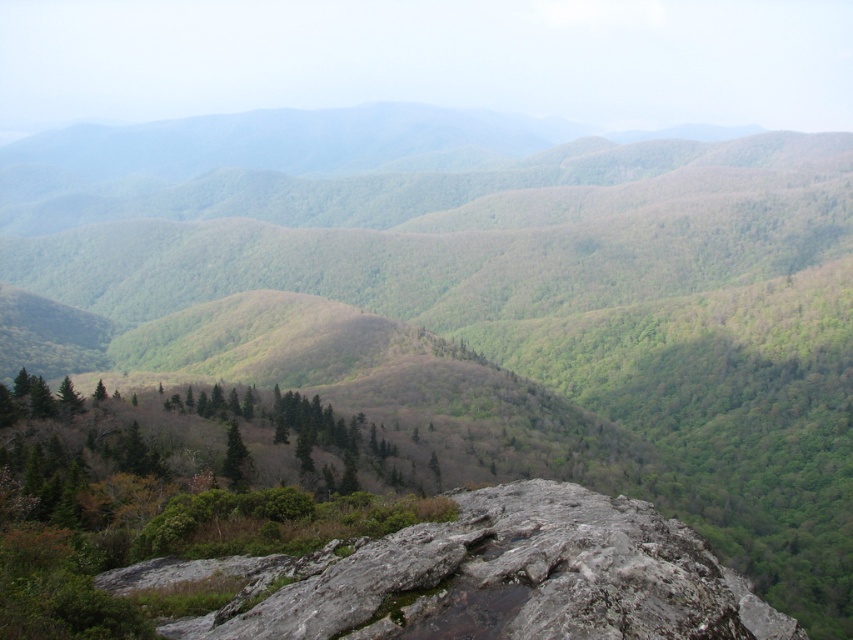
Is gray rough rock at center in front of green matte tree at center?

That is True.

The image size is (853, 640). I want to click on gray rough rock at center, so click(x=485, y=579).

At what (x,y) coordinates should I click in order to perform the action: click on gray rough rock at center. Please return your answer as a coordinate pair (x, y). The image size is (853, 640). Looking at the image, I should click on (485, 579).